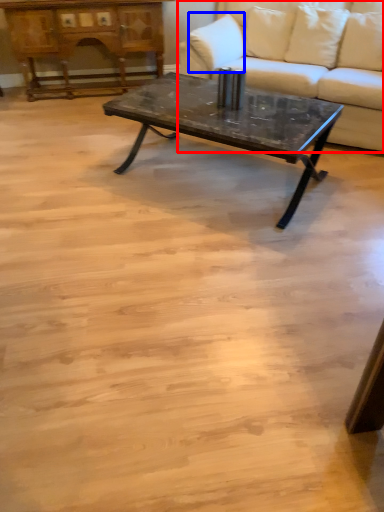
Question: Which of the following is the farthest to the observer, studio couch (highlighted by a red box) or pillow (highlighted by a blue box)?

Choices:
 (A) studio couch
 (B) pillow

Answer: (B)